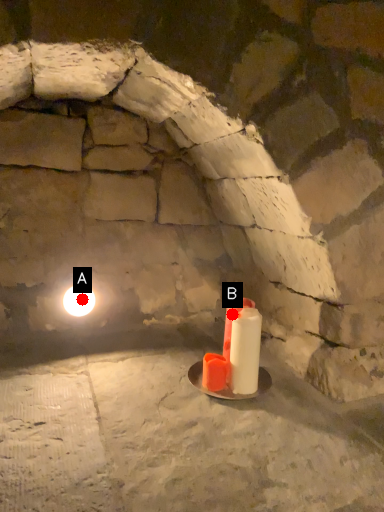
Question: Two points are circled on the image, labeled by A and B beside each circle. Which point appears closest to the camera in this image?

Choices:
 (A) A is closer
 (B) B is closer

Answer: (B)